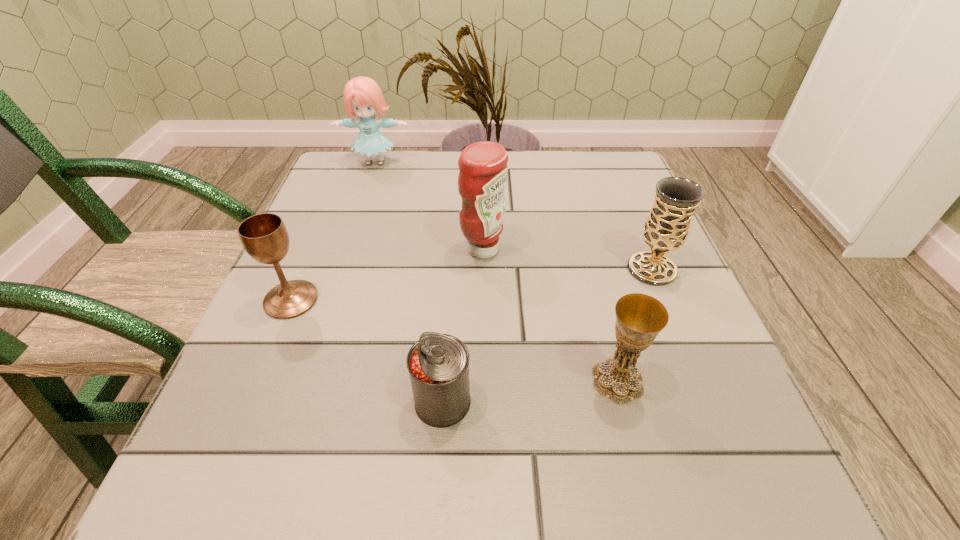
Where is `free space located 0.360m on the back of the leftmost chalice`? The width and height of the screenshot is (960, 540). free space located 0.360m on the back of the leftmost chalice is located at coordinates (343, 178).

Find the location of a particular element. This screenshot has width=960, height=540. free space located 0.110m on the right of the second chalice from right to left is located at coordinates (718, 381).

This screenshot has width=960, height=540. Find the location of `free space located 0.050m on the back of the shortest object`. free space located 0.050m on the back of the shortest object is located at coordinates (446, 350).

The height and width of the screenshot is (540, 960). Find the location of `object present at the far edge`. object present at the far edge is located at coordinates (362, 96).

Find the location of a particular element. The height and width of the screenshot is (540, 960). doll present at the left edge is located at coordinates click(362, 96).

You are a GUI agent. You are given a task and a screenshot of the screen. Output one action in this format:
    pyautogui.click(x=<x>, y=<y>)
    Task: Click on the chalice present at the left edge
    The image size is (960, 540).
    Given the screenshot: What is the action you would take?
    pyautogui.click(x=264, y=236)

Identify the location of object situated at the far left corner. (362, 96).

Where is `vacant space at the left edge of the desktop`? vacant space at the left edge of the desktop is located at coordinates (252, 411).

In order to click on free region at the right edge of the desktop in this screenshot , I will do `click(700, 390)`.

Locate an element on the screen. This screenshot has height=540, width=960. free space at the far left corner is located at coordinates (378, 184).